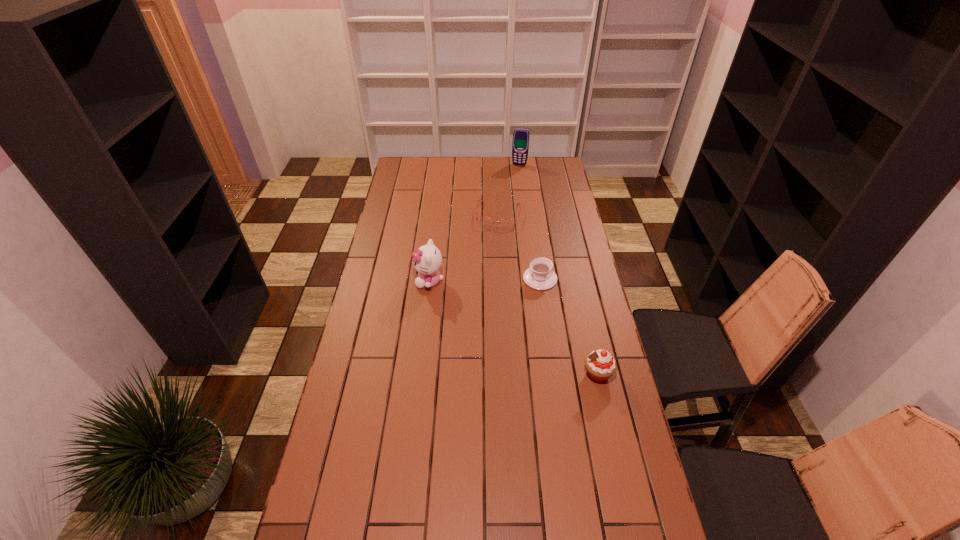
Identify the location of empty space that is in between the leftmost object and the second farthest object. This screenshot has width=960, height=540. (464, 247).

Identify the location of empty space that is in between the fourth tallest object and the kitten. (485, 280).

Find the location of `unoccupied position between the rightmost object and the teacup`. unoccupied position between the rightmost object and the teacup is located at coordinates pyautogui.click(x=568, y=326).

Identify the location of free space between the teacup and the spectacles. (519, 246).

This screenshot has width=960, height=540. Find the location of `unoccupied position between the rightmost object and the spectacles`. unoccupied position between the rightmost object and the spectacles is located at coordinates (548, 294).

Find the location of a particular element. The image size is (960, 540). free space between the spectacles and the fourth tallest object is located at coordinates (519, 246).

Locate an element on the screen. free space between the leftmost object and the spectacles is located at coordinates (464, 247).

The image size is (960, 540). I want to click on vacant area that lies between the cellular telephone and the fourth shortest object, so click(x=474, y=222).

Identify which object is located as the second nearest to the cellular telephone. Please provide its 2D coordinates. Your answer should be formatted as a tuple, i.e. [(x, y)], where the tuple contains the x and y coordinates of a point satisfying the conditions above.

[(540, 276)]

What are the coordinates of `object that is the fourth closest to the teacup` in the screenshot? It's located at (520, 145).